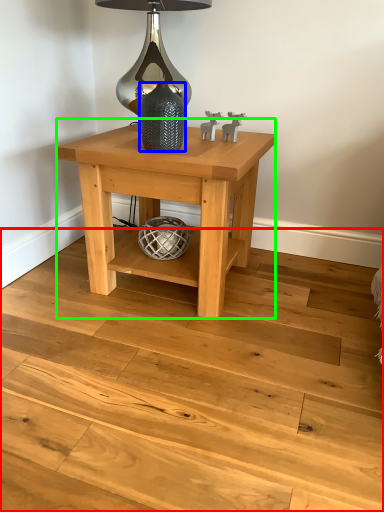
Question: Which object is positioned farthest from stair (highlighted by a red box)? Select from glass vase (highlighted by a blue box) and table (highlighted by a green box).

Choices:
 (A) glass vase
 (B) table

Answer: (A)